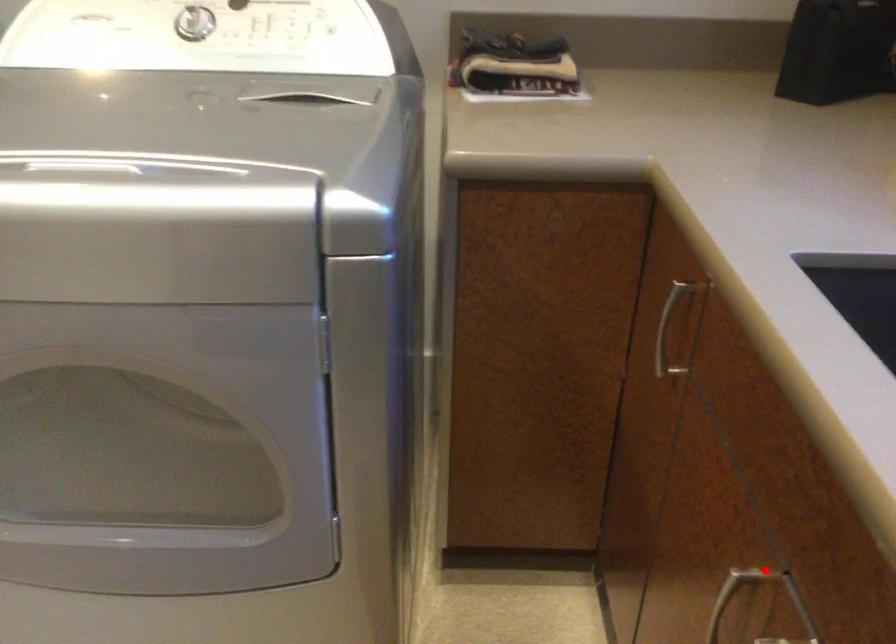
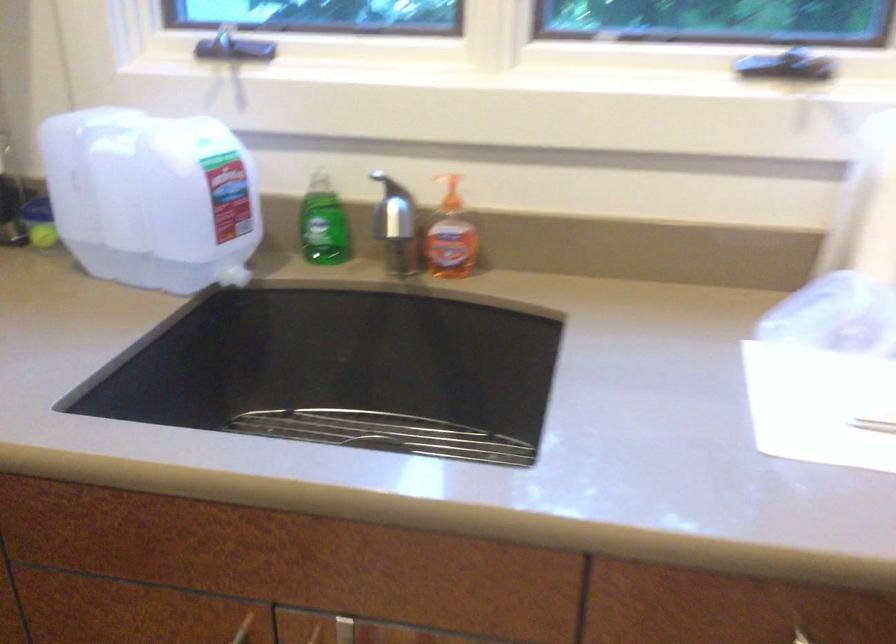
Question: I am providing you with two images of the same scene from different viewpoints. Given a red point in image1, look at the same physical point in image2. Is it:

Choices:
 (A) Closer to the viewpoint
 (B) Farther from the viewpoint

Answer: (B)